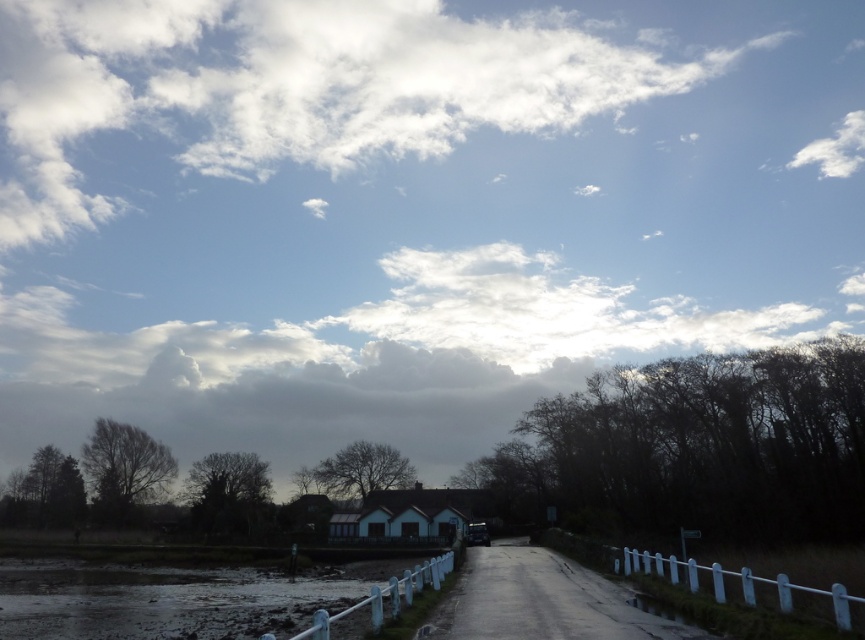
Which of these two, muddy wet ground at lower left or white plastic fence at lower right, stands taller?

muddy wet ground at lower left is taller.

Who is more forward, (299, 618) or (652, 566)?

Point (299, 618)

Between point (234, 568) and point (822, 625), which one is positioned in front?

Positioned in front is point (822, 625).

Where is `muddy wet ground at lower left`? This screenshot has width=865, height=640. muddy wet ground at lower left is located at coordinates (159, 602).

Is point (50, 61) farther from viewer compared to point (427, 579)?

Yes, point (50, 61) is farther from viewer.

Does white fluffy cloud at upper center come in front of white plastic fence at lower center?

No, white fluffy cloud at upper center is behind white plastic fence at lower center.

Does point (244, 54) lie in front of point (402, 577)?

No, (244, 54) is further to viewer.

This screenshot has width=865, height=640. I want to click on white fluffy cloud at upper center, so click(293, 88).

Is point (702, 616) positioned after point (356, 609)?

No, (702, 616) is closer to viewer.

Between point (755, 636) and point (382, 604), which one is positioned in front?

Point (755, 636)

Is point (787, 621) closer to viewer compared to point (377, 586)?

Yes, point (787, 621) is in front of point (377, 586).

Where is `white plastic fence at lower right`? This screenshot has height=640, width=865. white plastic fence at lower right is located at coordinates (746, 604).